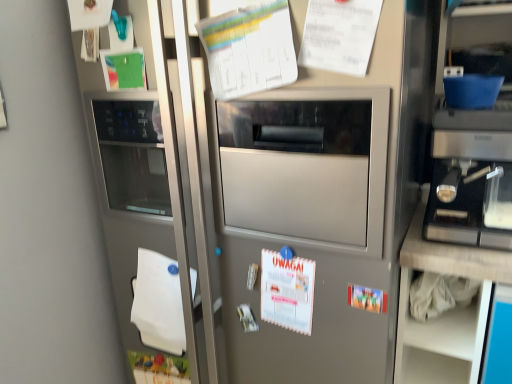
Question: Looking at the image, does matte plastic poster at center, arranged as the first poster when ordered from the bottom, seem bigger or smaller compared to sleek metallic espresso machine at right?

Choices:
 (A) small
 (B) big

Answer: (A)

Question: From a real-world perspective, is matte plastic poster at center, arranged as the first poster when ordered from the bottom, physically located above or below sleek metallic espresso machine at right?

Choices:
 (A) above
 (B) below

Answer: (B)

Question: Estimate the real-world distances between objects in this image. Which object is farther from the white paper calendar at center, which ranks as the second poster in bottom-to-top order?

Choices:
 (A) white paper at upper center, which is the fourth poster in bottom-to-top order
 (B) matte plastic poster at center, arranged as the first poster when ordered from the bottom
 (C) satin silver refrigerator at center
 (D) white paper at lower left
 (E) sleek metallic espresso machine at right

Answer: (A)

Question: Which object is the closest to the white paper at upper center, which is the fourth poster in bottom-to-top order?

Choices:
 (A) sleek metallic espresso machine at right
 (B) white paper at upper center, positioned as the 3th poster in bottom-to-top order
 (C) white paper at lower left
 (D) matte plastic poster at center, marked as the fourth poster in a top-to-bottom arrangement
 (E) satin silver refrigerator at center

Answer: (B)